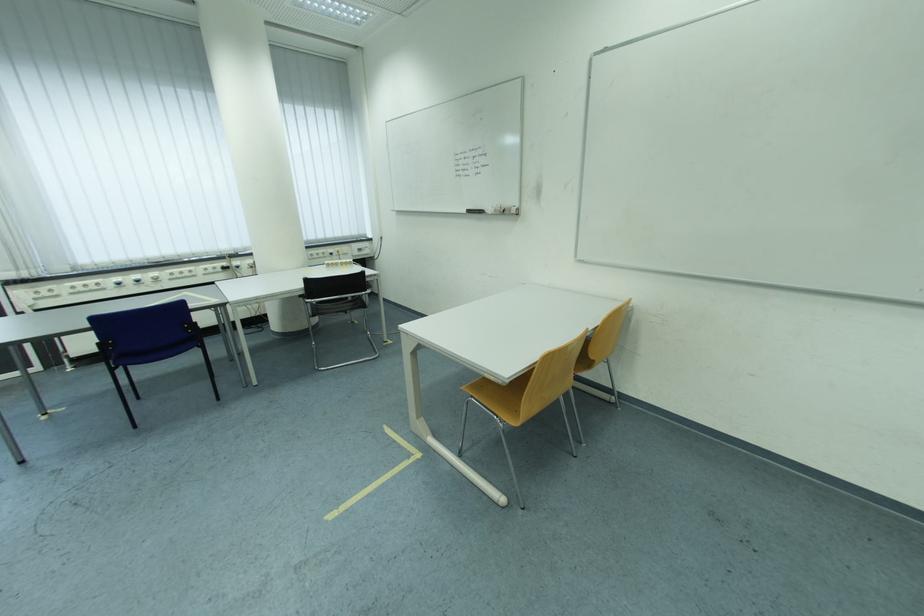
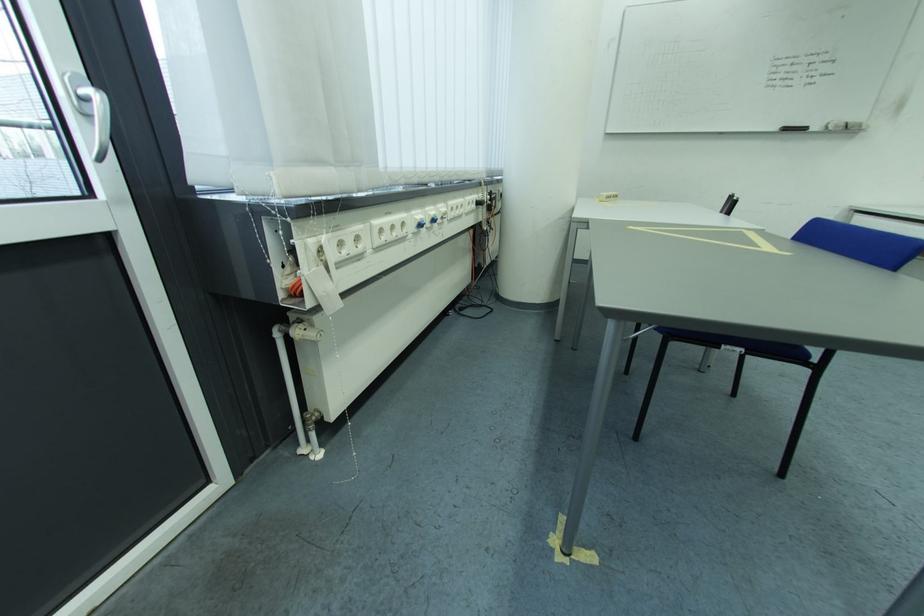
Locate, in the second image, the point that corresponds to pixel 478 214 in the first image.

(796, 131)